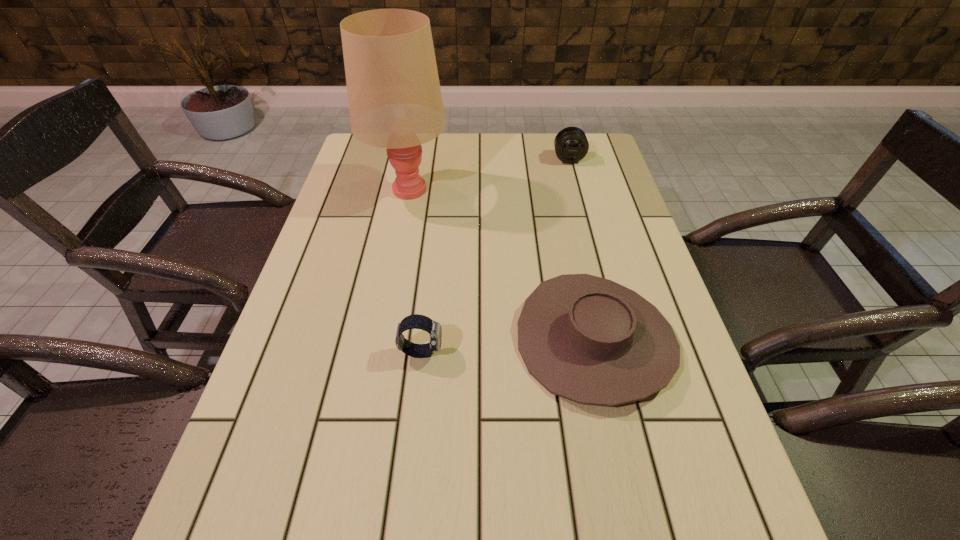
At what (x,y) coordinates should I click in order to perform the action: click on telephoto lens that is at the far edge. Please return your answer as a coordinate pair (x, y). Looking at the image, I should click on (571, 145).

This screenshot has width=960, height=540. In order to click on object situated at the left edge in this screenshot , I will do `click(395, 102)`.

I want to click on telephoto lens that is at the right edge, so click(x=571, y=145).

The width and height of the screenshot is (960, 540). I want to click on cowboy hat that is at the right edge, so click(588, 339).

At what (x,y) coordinates should I click in order to perform the action: click on object at the far left corner. Please return your answer as a coordinate pair (x, y). This screenshot has width=960, height=540. Looking at the image, I should click on (395, 102).

Find the location of a particular element. This screenshot has height=540, width=960. object positioned at the far right corner is located at coordinates (571, 145).

You are a GUI agent. You are given a task and a screenshot of the screen. Output one action in this format:
    pyautogui.click(x=<x>, y=<y>)
    Task: Click on the vacant space at the far edge
    The width and height of the screenshot is (960, 540).
    Given the screenshot: What is the action you would take?
    pyautogui.click(x=489, y=167)

This screenshot has width=960, height=540. In the image, there is a desktop. In order to click on vacant area at the left edge in this screenshot , I will do `click(256, 447)`.

Where is `vacant region at the right edge of the desktop`? This screenshot has width=960, height=540. vacant region at the right edge of the desktop is located at coordinates (604, 212).

Find the location of a particular element. This screenshot has width=960, height=540. free space at the far left corner is located at coordinates (386, 154).